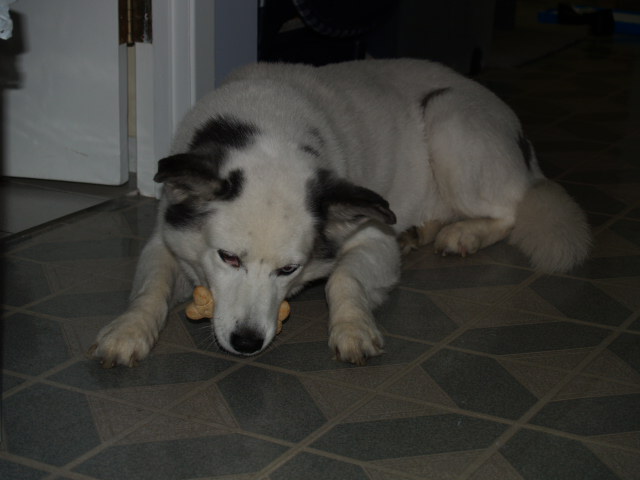
Identify the location of door. (80, 88).